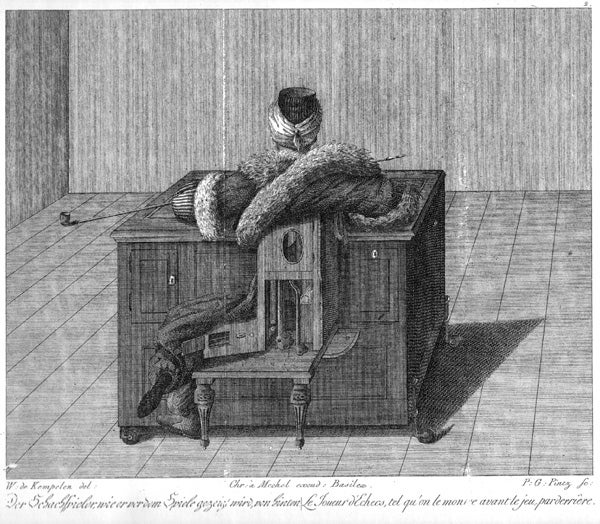
I want to click on table leg, so click(310, 425), click(211, 418), click(416, 432), click(450, 340), click(130, 429).